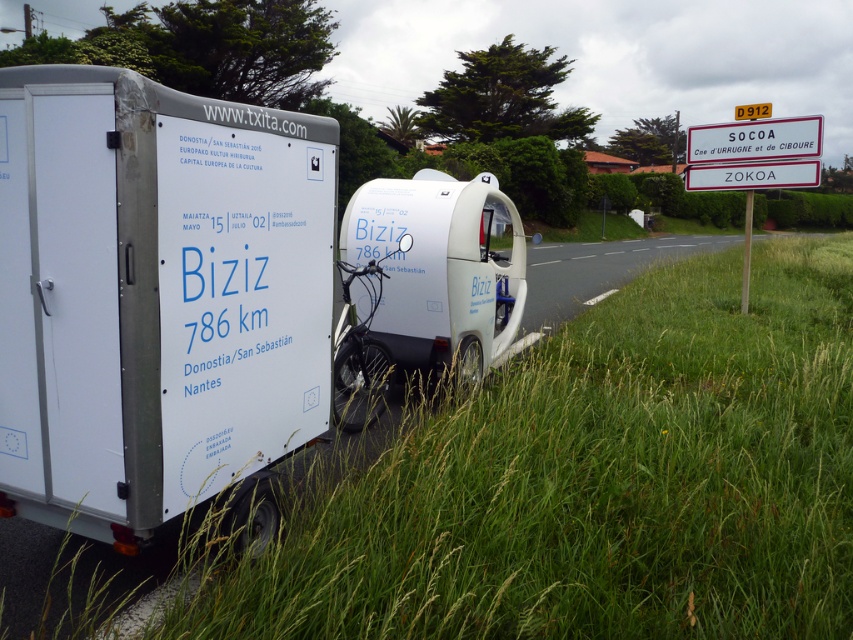
Question: Can you confirm if white matte trailer at left is thinner than white plastic sign at upper center?

Choices:
 (A) yes
 (B) no

Answer: (B)

Question: Among these objects, which one is nearest to the camera?

Choices:
 (A) metallic bicycle at center
 (B) white matte trailer at left
 (C) white plastic sign at upper right

Answer: (B)

Question: Is the position of metallic bicycle at center more distant than that of white plastic sign at upper center?

Choices:
 (A) yes
 (B) no

Answer: (B)

Question: Can you confirm if metallic bicycle at center is positioned above white plastic sign at upper center?

Choices:
 (A) yes
 (B) no

Answer: (B)

Question: Which of these objects is positioned farthest from the green grass at lower right?

Choices:
 (A) metallic bicycle at center
 (B) white plastic sign at upper right

Answer: (B)

Question: Which of the following is the farthest from the observer?

Choices:
 (A) white plastic sign at upper center
 (B) metallic bicycle at center
 (C) white matte trailer at left
 (D) green grass at lower right

Answer: (A)